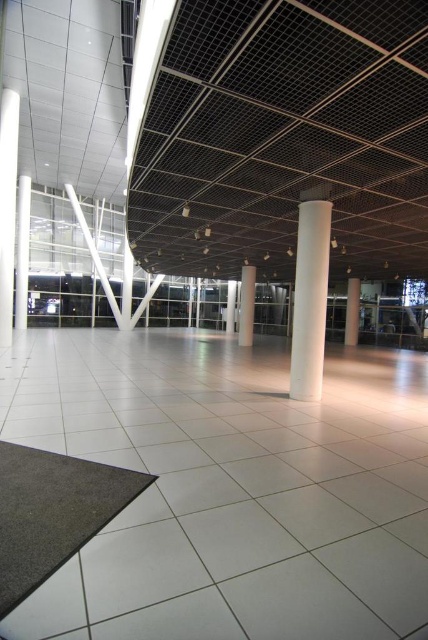
You are standing at the entrance of the space and want to walk straight to the white smooth pillar at right. However, there is a white smooth pillar at center in your path. Which direction should you move to avoid it?

Since the white smooth pillar at center is to the left of the white smooth pillar at right, you should move to the right to bypass the pillar in your path and reach your destination.

You are standing at the entrance of the space and want to walk straight towards the pillars. Which pillar will you encounter first, the white smooth pillar at center or the white glossy pillar at center?

The white smooth pillar at center is in front of the white glossy pillar at center, so you will encounter the white smooth pillar at center first.

In the scene shown: You are an architect designing a new layout for this space. You need to place a 20 meter long sculpture between the white smooth column at center and the white glossy pillar at left. Will there be enough space between them to accommodate the sculpture?

The distance between the white smooth column at center and the white glossy pillar at left is 22.30 meters, which is longer than the 20 meter sculpture. Therefore, there is sufficient space to place the sculpture between them.